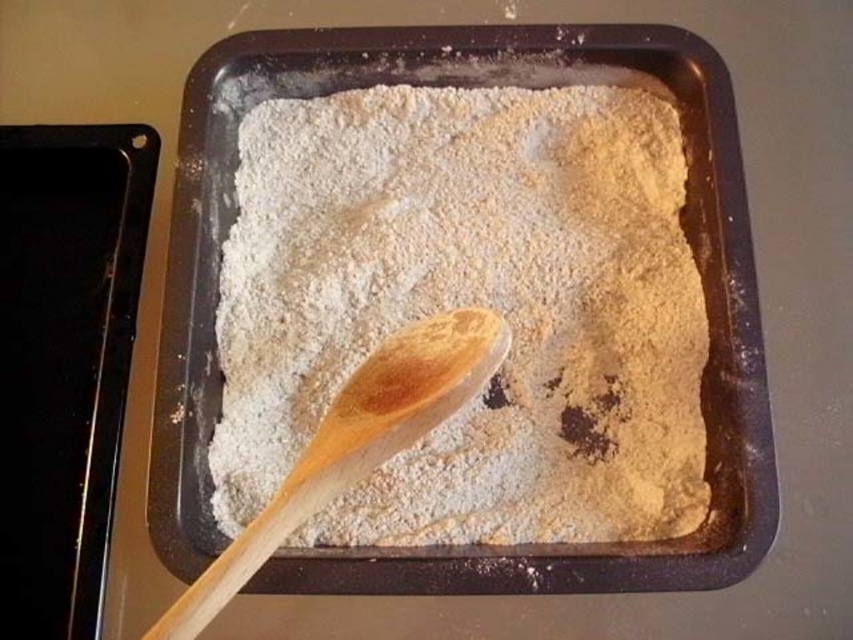
Question: Can you confirm if light brown powder at center is thinner than wooden spoon at center?

Choices:
 (A) yes
 (B) no

Answer: (B)

Question: Is light brown powder at center to the left of wooden spoon at center from the viewer's perspective?

Choices:
 (A) no
 (B) yes

Answer: (A)

Question: Which point is closer to the camera taking this photo?

Choices:
 (A) (397, 387)
 (B) (254, 372)

Answer: (A)

Question: Which point is farther to the camera?

Choices:
 (A) wooden spoon at center
 (B) light brown powder at center

Answer: (B)

Question: Where is light brown powder at center located in relation to wooden spoon at center in the image?

Choices:
 (A) left
 (B) right

Answer: (B)